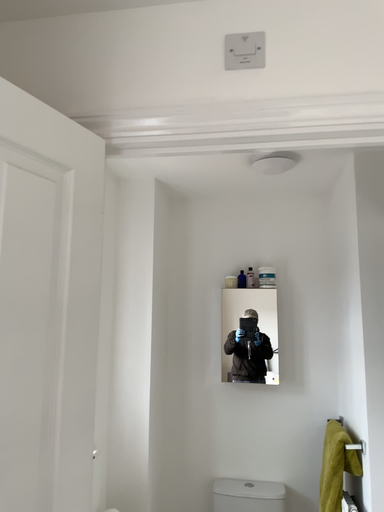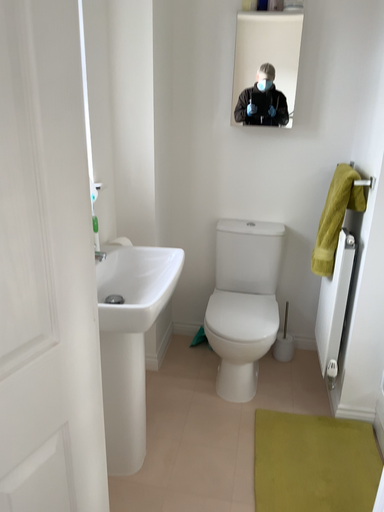
Question: Which way did the camera rotate in the video?

Choices:
 (A) rotated upward
 (B) rotated downward

Answer: (B)